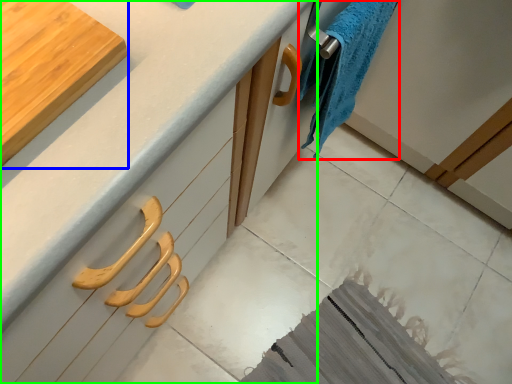
Question: Which object is the farthest from bath towel (highlighted by a red box)? Choose among these: cutting board (highlighted by a blue box) or countertop (highlighted by a green box).

Choices:
 (A) cutting board
 (B) countertop

Answer: (A)